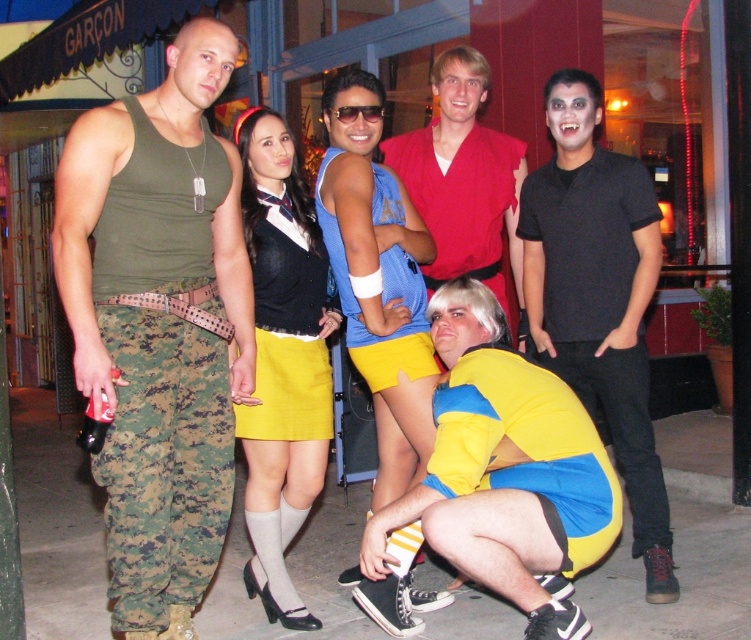
Consider the image. Based on the scene description, which object is located lower in the image, the camouflage pants at left or the matte blue tank top at center?

The camouflage pants at left is positioned under the matte blue tank top at center, so the camouflage pants at left is located lower in the image.

You are a fashion designer analyzing the group. Which clothing item has a larger size between the camouflage pants at left and the matte blue tank top at center?

The camouflage pants at left has a larger size compared to the matte blue tank top at center.

How far apart are the matte yellow skirt at center and the green sleeveless tank top on the left?

The matte yellow skirt at center and the green sleeveless tank top on the left are 11.66 feet apart.